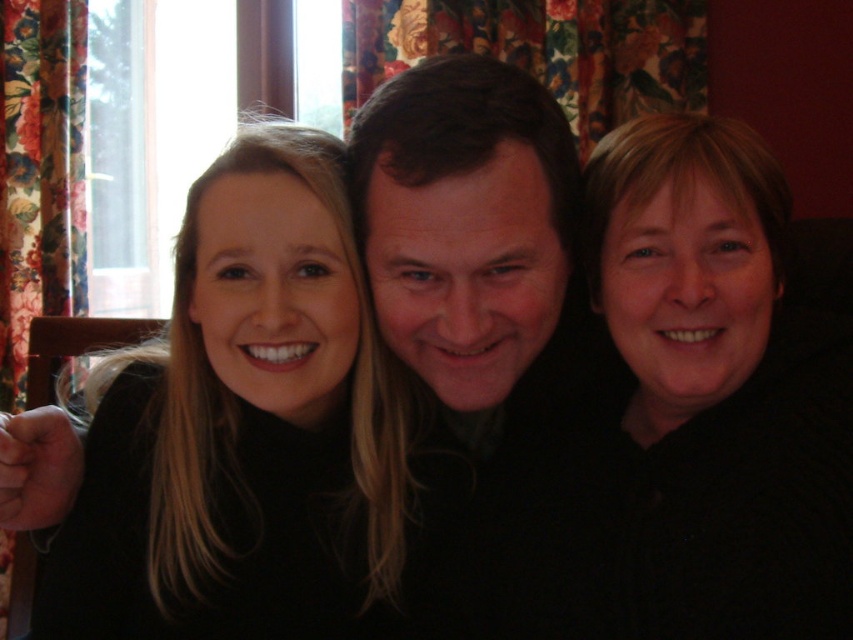
Consider the image. Based on the scene description, which object has a greater width when comparing the smooth skin face at center and the floral fabric curtain at left?

The smooth skin face at center has a greater width than the floral fabric curtain at left according to the description.

You are a photographer trying to frame a group photo. You notice the smooth black hair at center and the black matte hair at upper right. Which of these two has a wider spread of hair?

The smooth black hair at center has a wider spread of hair than the black matte hair at upper right because its width is larger.

You are taking a photo of three friends. You notice the smooth black hair at center and the black matte hair at upper right in the frame. Which one is positioned lower in the image?

The smooth black hair at center is positioned lower than the black matte hair at upper right.